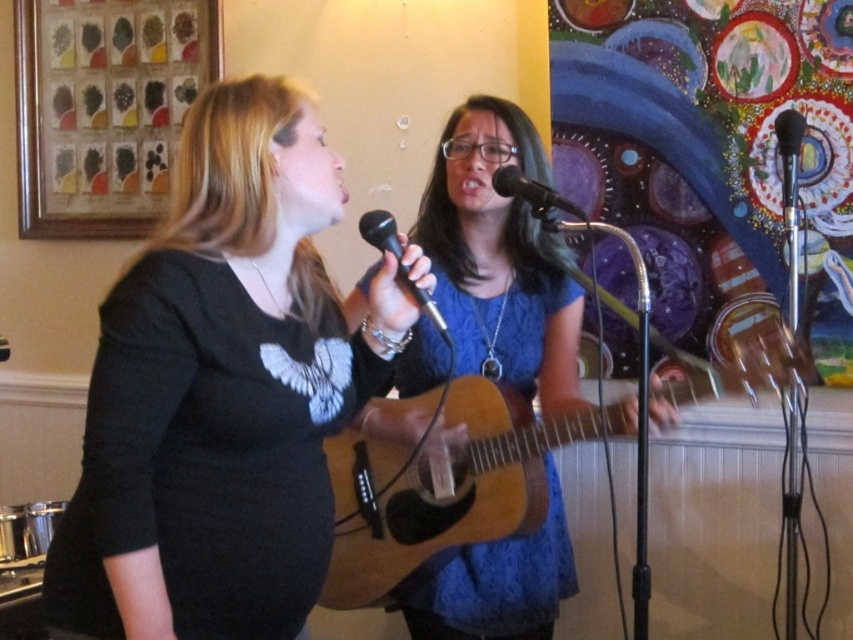
Question: Is black matte shirt at center in front of black metallic microphone at upper right?

Choices:
 (A) no
 (B) yes

Answer: (B)

Question: Based on their relative distances, which object is nearer to the black matte shirt at center?

Choices:
 (A) black matte microphone at center
 (B) blue fabric guitar at center

Answer: (B)

Question: Which point is closer to the camera taking this photo?

Choices:
 (A) (518, 176)
 (B) (791, 164)
 (C) (491, 464)

Answer: (C)

Question: Can you confirm if light brown acoustic guitar at center is positioned above black matte microphone at center?

Choices:
 (A) yes
 (B) no

Answer: (B)

Question: Is black matte shirt at center positioned before black plastic microphone at center?

Choices:
 (A) no
 (B) yes

Answer: (B)

Question: Which point appears farthest from the camera in this image?

Choices:
 (A) 444,332
 (B) 224,538
 (C) 784,180
 (D) 357,531

Answer: (C)